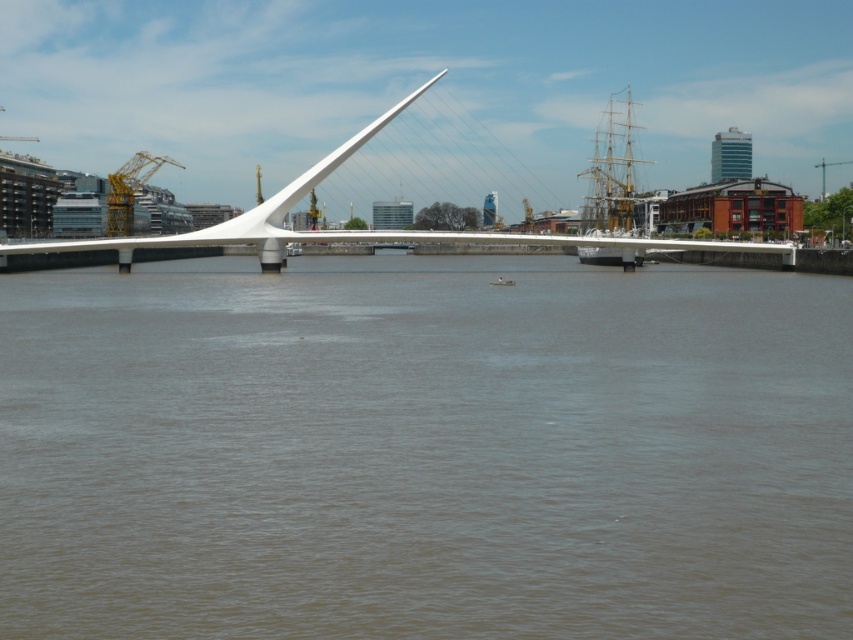
Question: Which point is closer to the camera taking this photo?

Choices:
 (A) (634, 209)
 (B) (135, 177)
 (C) (567, 496)

Answer: (C)

Question: Which point appears closest to the camera in this image?

Choices:
 (A) (547, 547)
 (B) (119, 180)

Answer: (A)

Question: In this image, where is brown matte water at center located relative to yellow metallic crane at upper left?

Choices:
 (A) left
 (B) right

Answer: (B)

Question: Does wooden ship at right lie in front of yellow metallic crane at upper left?

Choices:
 (A) no
 (B) yes

Answer: (B)

Question: Is wooden ship at right positioned at the back of yellow metallic crane at upper left?

Choices:
 (A) yes
 (B) no

Answer: (B)

Question: Which of the following is the closest to the observer?

Choices:
 (A) (596, 205)
 (B) (126, 173)
 (C) (165, 502)

Answer: (C)